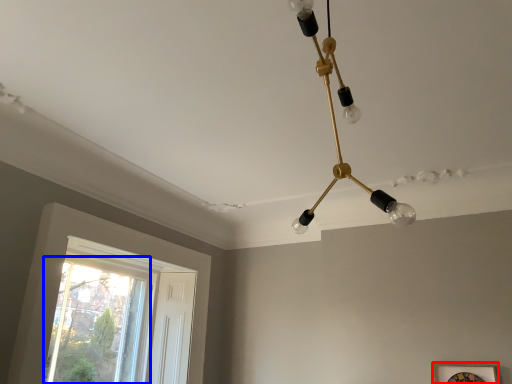
Question: Which object appears closest to the camera in this image, picture frame (highlighted by a red box) or window (highlighted by a blue box)?

Choices:
 (A) picture frame
 (B) window

Answer: (A)